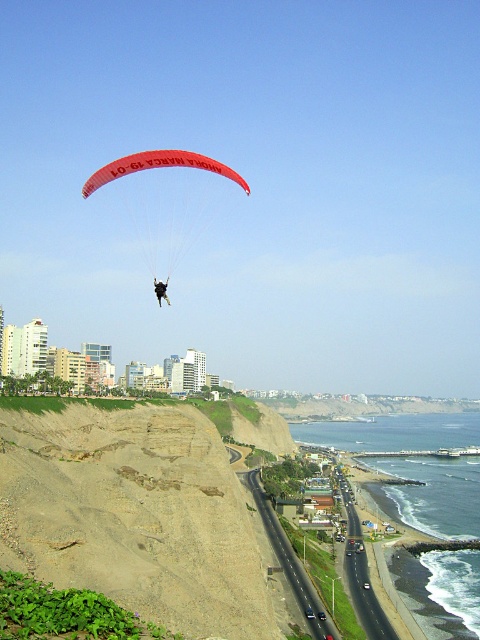
Question: Among these points, which one is farthest from the camera?

Choices:
 (A) (160, 300)
 (B) (184, 154)

Answer: (A)

Question: Can you confirm if red nylon parachute at center is positioned to the right of black fabric parachute at upper center?

Choices:
 (A) no
 (B) yes

Answer: (A)

Question: Does red nylon parachute at center appear on the left side of black fabric parachute at upper center?

Choices:
 (A) yes
 (B) no

Answer: (A)

Question: Does red nylon parachute at center have a smaller size compared to black fabric parachute at upper center?

Choices:
 (A) no
 (B) yes

Answer: (A)